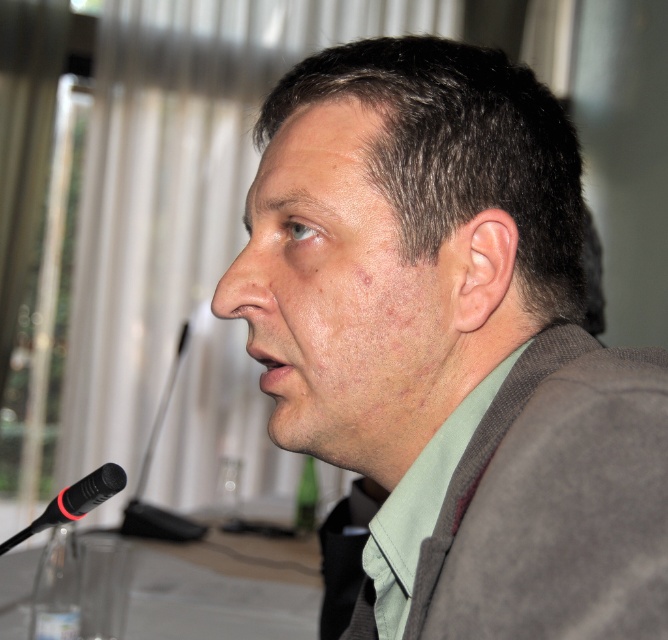
Question: Can you confirm if clear glass table at lower left is positioned below black rubberized microphone at lower left?

Choices:
 (A) no
 (B) yes

Answer: (B)

Question: Where is clear glass table at lower left located in relation to transparent glass bottle at lower left in the image?

Choices:
 (A) below
 (B) above

Answer: (A)

Question: Which point is closer to the camera?

Choices:
 (A) transparent glass bottle at lower left
 (B) matte gray suit at center
 (C) black rubberized microphone at lower left
 (D) clear glass table at lower left

Answer: (B)

Question: Which of the following is the farthest from the observer?

Choices:
 (A) black rubberized microphone at lower left
 (B) clear glass table at lower left

Answer: (B)

Question: Is clear glass table at lower left to the right of green glass bottle at lower center from the viewer's perspective?

Choices:
 (A) yes
 (B) no

Answer: (B)

Question: Which object appears farthest from the camera in this image?

Choices:
 (A) green glass bottle at lower center
 (B) black rubberized microphone at lower left
 (C) clear glass table at lower left

Answer: (A)